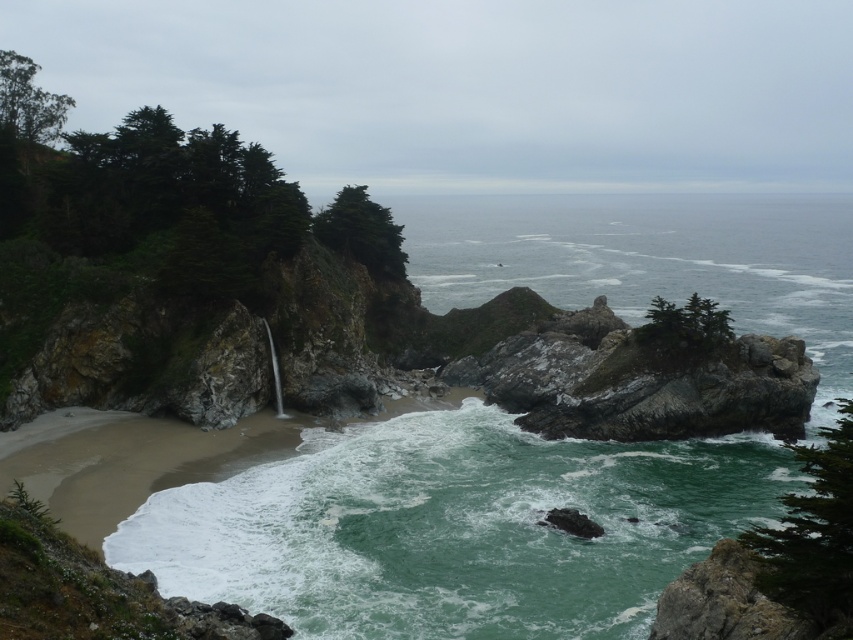
Is green rock at center below greenish-blue water at center?

Indeed, green rock at center is positioned under greenish-blue water at center.

Is point (676, 540) positioned in front of point (836, 276)?

Yes, it is.

This screenshot has height=640, width=853. Find the location of `green rock at center`. green rock at center is located at coordinates click(451, 525).